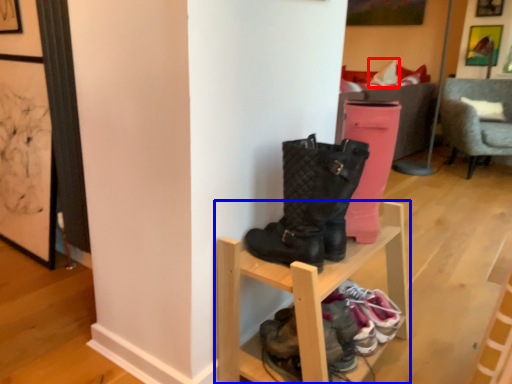
Question: Among these objects, which one is farthest to the camera, pillow (highlighted by a red box) or shelf (highlighted by a blue box)?

Choices:
 (A) pillow
 (B) shelf

Answer: (A)